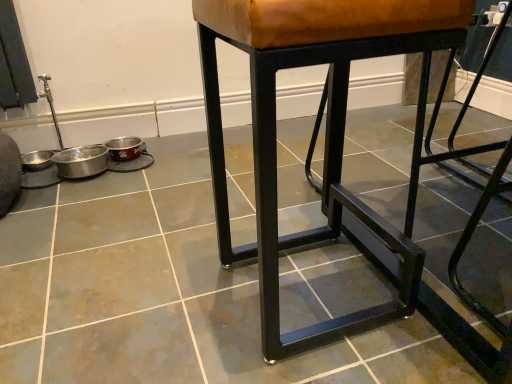
Image resolution: width=512 pixels, height=384 pixels. What are the coordinates of `free area below brown leather stool at center (from a real-world perspective)` in the screenshot? It's located at (296, 296).